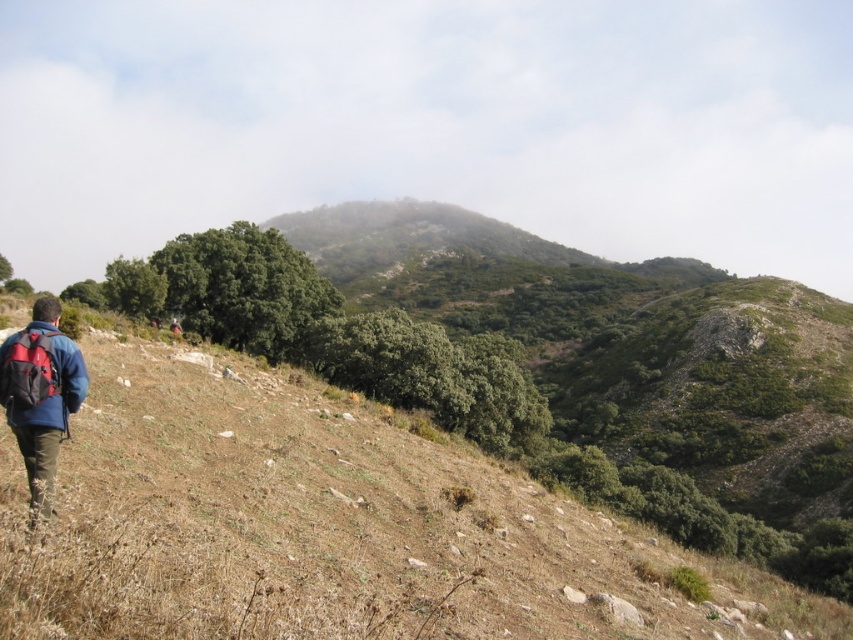
Question: Which of the following is the farthest from the observer?

Choices:
 (A) brown grassy hillside at lower left
 (B) blue fabric jacket at lower left

Answer: (B)

Question: Does brown grassy hillside at lower left lie behind blue fabric jacket at lower left?

Choices:
 (A) no
 (B) yes

Answer: (A)

Question: Is brown grassy hillside at lower left behind red fabric backpack at lower left?

Choices:
 (A) yes
 (B) no

Answer: (B)

Question: Which point appears farthest from the camera in this image?

Choices:
 (A) (32, 397)
 (B) (4, 376)
 (C) (410, 614)

Answer: (C)

Question: Which object appears farthest from the camera in this image?

Choices:
 (A) red fabric backpack at lower left
 (B) blue fabric jacket at lower left
 (C) brown grassy hillside at lower left

Answer: (A)

Question: Is brown grassy hillside at lower left to the right of red fabric backpack at lower left from the viewer's perspective?

Choices:
 (A) yes
 (B) no

Answer: (A)